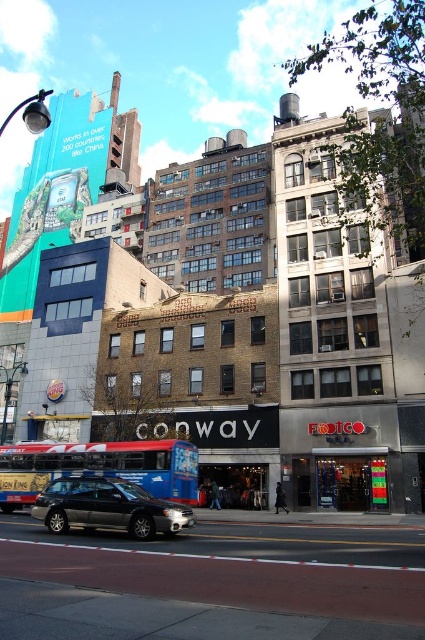
Question: Among these points, which one is farthest from the camera?

Choices:
 (A) (121, 508)
 (B) (88, 458)

Answer: (B)

Question: Can you confirm if blue metallic bus at center is bigger than metallic gray sedan at center?

Choices:
 (A) yes
 (B) no

Answer: (A)

Question: Among these points, which one is farthest from the camera?

Choices:
 (A) (180, 460)
 (B) (107, 499)

Answer: (A)

Question: Does blue metallic bus at center lie in front of metallic gray sedan at center?

Choices:
 (A) no
 (B) yes

Answer: (A)

Question: Does blue metallic bus at center appear over metallic gray sedan at center?

Choices:
 (A) yes
 (B) no

Answer: (B)

Question: Among these objects, which one is farthest from the camera?

Choices:
 (A) metallic gray sedan at center
 (B) blue metallic bus at center

Answer: (B)